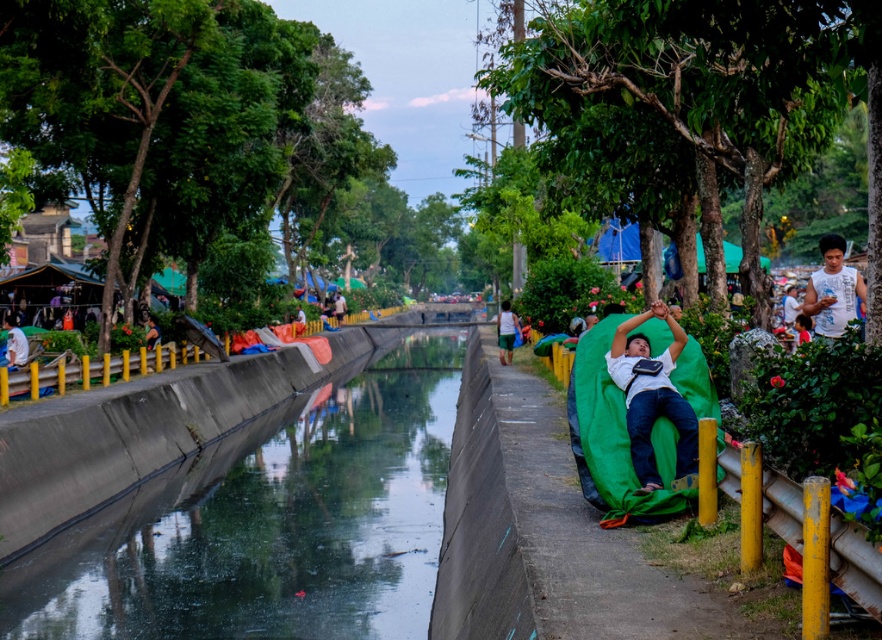
You are standing on the left side of the river and want to reach the green fabric bag at center without crossing the smooth concrete canal at center. Is there a path available to your right that allows you to bypass the canal?

The smooth concrete canal at center is to the left of the green fabric bag at center, so the canal is between you and the bag. To reach the bag without crossing the canal, you would need to go around to the right side of the canal. However, the scene description mentions only the embankment on the right side of the river and no additional pathways. Therefore, there may not be a clear path to the right that allows bypassing the canal without crossing it.

What is located at the coordinates point [506,332]?

The point [506,332] is on the green fabric bag at center.

You are standing at the riverside and want to place a small potted plant between the smooth concrete canal at center and the green fabric bag at center. Which object should you place it closer to if you want the plant to be visible to someone approaching from the front?

You should place the potted plant closer to the smooth concrete canal at center because it is closer to the viewer than the green fabric bag at center, making it more visible to someone approaching from the front.